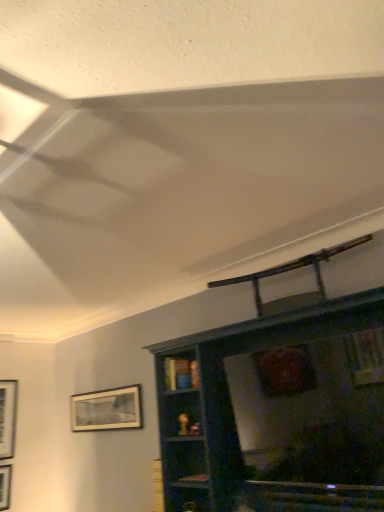
Question: Does matte black picture frame at lower left, which is counted as the first picture frame, starting from the right, contain dark wood shelf at upper center?

Choices:
 (A) yes
 (B) no

Answer: (B)

Question: Is matte black picture frame at lower left, which is counted as the 2th picture frame, starting from the left, taller than dark wood shelf at upper center?

Choices:
 (A) no
 (B) yes

Answer: (A)

Question: From a real-world perspective, is matte black picture frame at lower left, which is counted as the 2th picture frame, starting from the left, on top of dark wood shelf at upper center?

Choices:
 (A) no
 (B) yes

Answer: (B)

Question: From the image's perspective, is matte black picture frame at lower left, which is counted as the 2th picture frame, starting from the left, under dark wood shelf at upper center?

Choices:
 (A) no
 (B) yes

Answer: (B)

Question: Is matte black picture frame at lower left, which is counted as the 2th picture frame, starting from the left, bigger or smaller than matte black picture frame at left, which is the second picture frame in right-to-left order?

Choices:
 (A) small
 (B) big

Answer: (B)

Question: Considering the positions of matte black picture frame at lower left, which is counted as the first picture frame, starting from the right, and matte black picture frame at left, the first picture frame in the left-to-right sequence, in the image, is matte black picture frame at lower left, which is counted as the first picture frame, starting from the right, taller or shorter than matte black picture frame at left, the first picture frame in the left-to-right sequence,?

Choices:
 (A) tall
 (B) short

Answer: (B)

Question: Visually, is matte black picture frame at lower left, which is counted as the 2th picture frame, starting from the left, positioned to the left or to the right of matte black picture frame at left, which is the second picture frame in right-to-left order?

Choices:
 (A) right
 (B) left

Answer: (A)

Question: Considering the positions of point (79, 406) and point (8, 430), is point (79, 406) closer or farther from the camera than point (8, 430)?

Choices:
 (A) farther
 (B) closer

Answer: (A)

Question: Is dark wood shelf at upper center situated inside metallic silver swivel chair at upper center or outside?

Choices:
 (A) outside
 (B) inside

Answer: (A)

Question: Considering the positions of dark wood shelf at upper center and metallic silver swivel chair at upper center in the image, is dark wood shelf at upper center wider or thinner than metallic silver swivel chair at upper center?

Choices:
 (A) thin
 (B) wide

Answer: (B)

Question: Visually, is dark wood shelf at upper center positioned to the left or to the right of metallic silver swivel chair at upper center?

Choices:
 (A) right
 (B) left

Answer: (B)

Question: Based on their sizes in the image, would you say dark wood shelf at upper center is bigger or smaller than metallic silver swivel chair at upper center?

Choices:
 (A) small
 (B) big

Answer: (B)

Question: Considering the positions of dark wood shelf at upper center and matte black picture frame at lower left, which is counted as the first picture frame, starting from the right, in the image, is dark wood shelf at upper center wider or thinner than matte black picture frame at lower left, which is counted as the first picture frame, starting from the right,?

Choices:
 (A) thin
 (B) wide

Answer: (B)

Question: Is dark wood shelf at upper center taller or shorter than matte black picture frame at lower left, which is counted as the first picture frame, starting from the right?

Choices:
 (A) tall
 (B) short

Answer: (A)